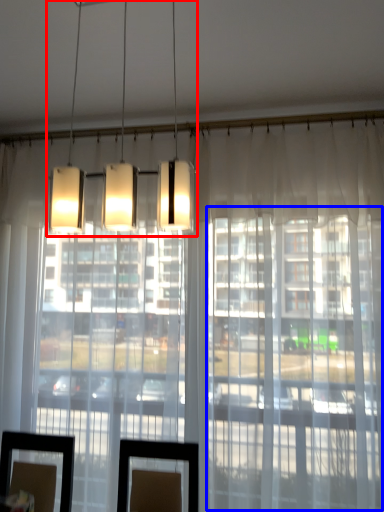
Question: Which object is closer to the camera taking this photo, lamp (highlighted by a red box) or glass door (highlighted by a blue box)?

Choices:
 (A) lamp
 (B) glass door

Answer: (A)